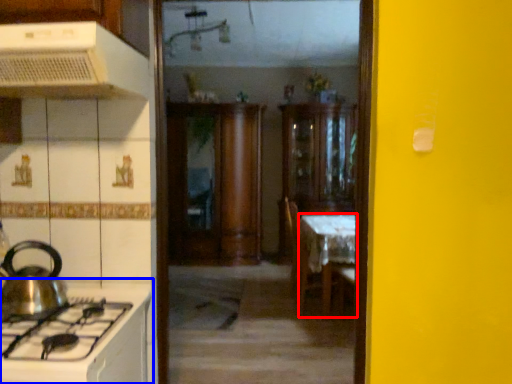
Question: Among these objects, which one is farthest to the camera, table (highlighted by a red box) or countertop (highlighted by a blue box)?

Choices:
 (A) table
 (B) countertop

Answer: (A)